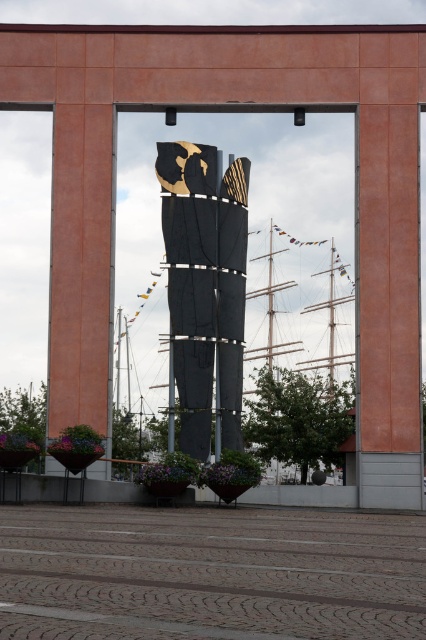
You are an interior designer planning to place a new piece of furniture in the space between the black textured fabric at center and the matte orange pillar at center. Based on their sizes, which object should you consider moving to accommodate the new furniture?

The black textured fabric at center is larger in size than the matte orange pillar at center, so you should consider moving the black textured fabric at center to accommodate the new furniture.

You are an interior designer planning to place a new decorative item in the space between the black textured fabric at center and the matte orange pillar at center. Based on their positions, can you determine which object is closer to the ceiling?

The black textured fabric at center is above the matte orange pillar at center, so it is closer to the ceiling.